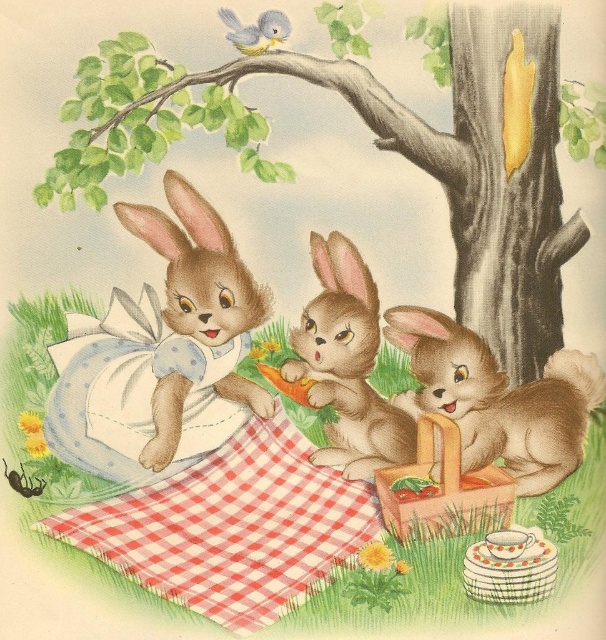
Question: Which object is positioned closest to the fuzzy brown rabbit at lower right?

Choices:
 (A) smooth gray bark at center
 (B) red checkered picnic blanket at center
 (C) soft brown fur rabbit at center
 (D) soft brown fur rabbit at left

Answer: (C)

Question: Can you confirm if smooth gray bark at center is thinner than red checkered picnic blanket at center?

Choices:
 (A) no
 (B) yes

Answer: (A)

Question: Does fuzzy brown rabbit at lower right have a smaller size compared to soft brown fur rabbit at left?

Choices:
 (A) no
 (B) yes

Answer: (B)

Question: Which object appears closest to the camera in this image?

Choices:
 (A) smooth gray bark at center
 (B) fuzzy brown rabbit at lower right
 (C) red checkered picnic blanket at center

Answer: (C)

Question: Can you confirm if smooth gray bark at center is smaller than soft brown fur rabbit at center?

Choices:
 (A) no
 (B) yes

Answer: (A)

Question: Which point is closer to the camera?

Choices:
 (A) red checkered picnic blanket at center
 (B) smooth gray bark at center

Answer: (A)